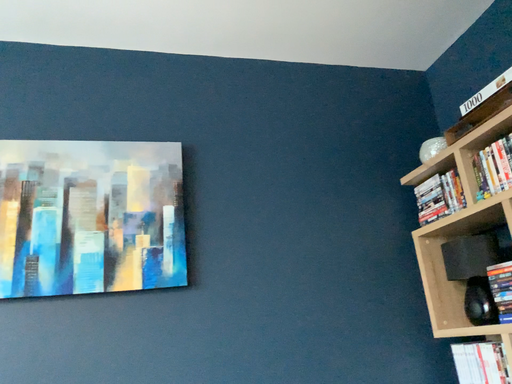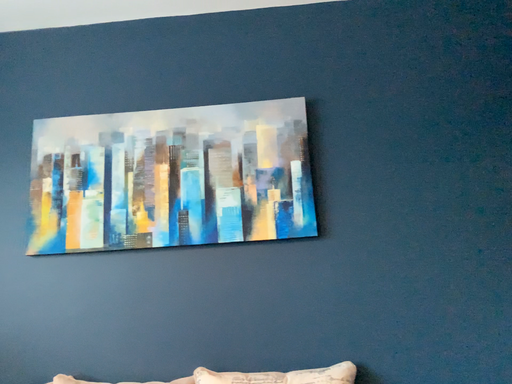
Question: Which way did the camera rotate in the video?

Choices:
 (A) rotated upward
 (B) rotated downward

Answer: (B)